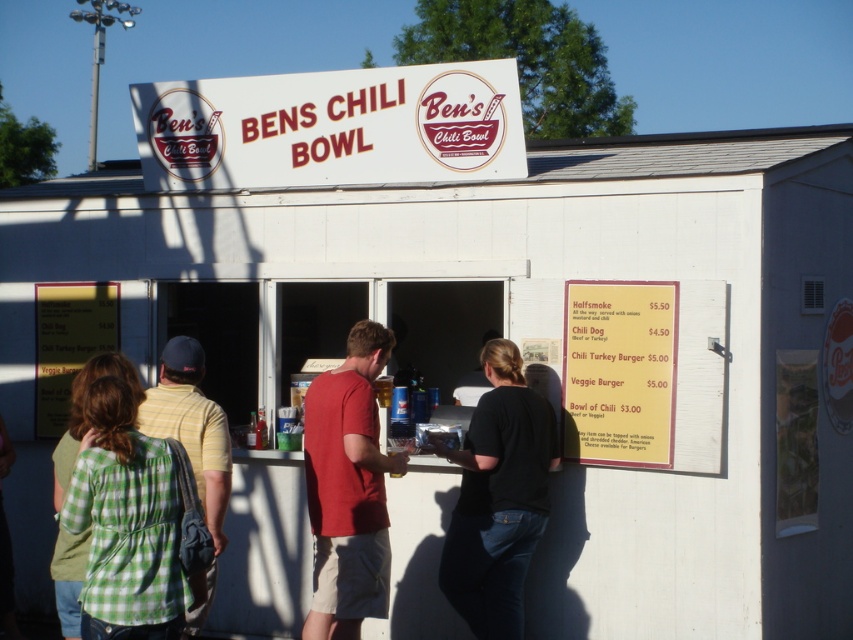
You are a customer at Ben s Chili Bowl and you notice two employees wearing shirts. One is wearing a black cotton shirt at center and the other is wearing a yellow striped shirt at center. Which employee is closer to you?

The black cotton shirt at center is closer to you because the yellow striped shirt at center is behind it.